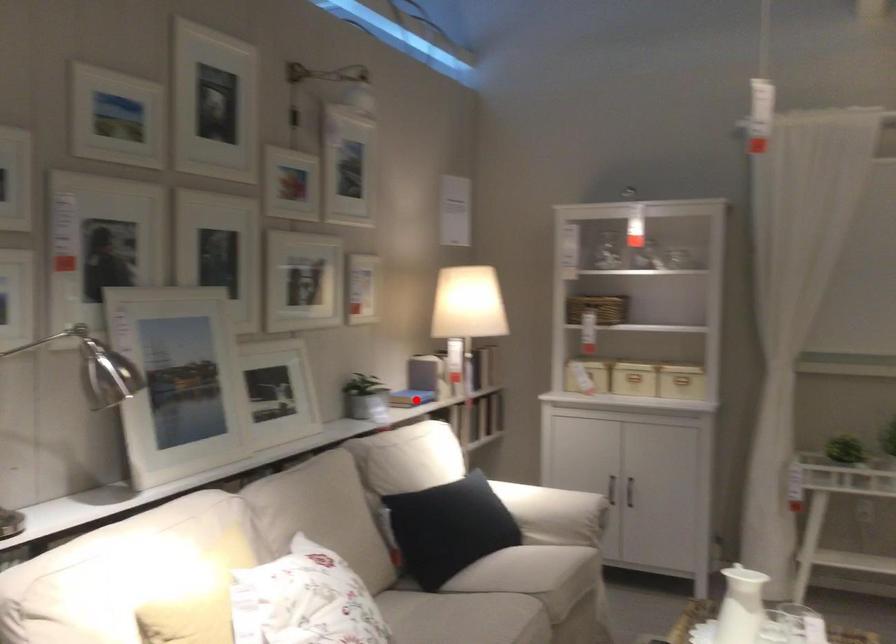
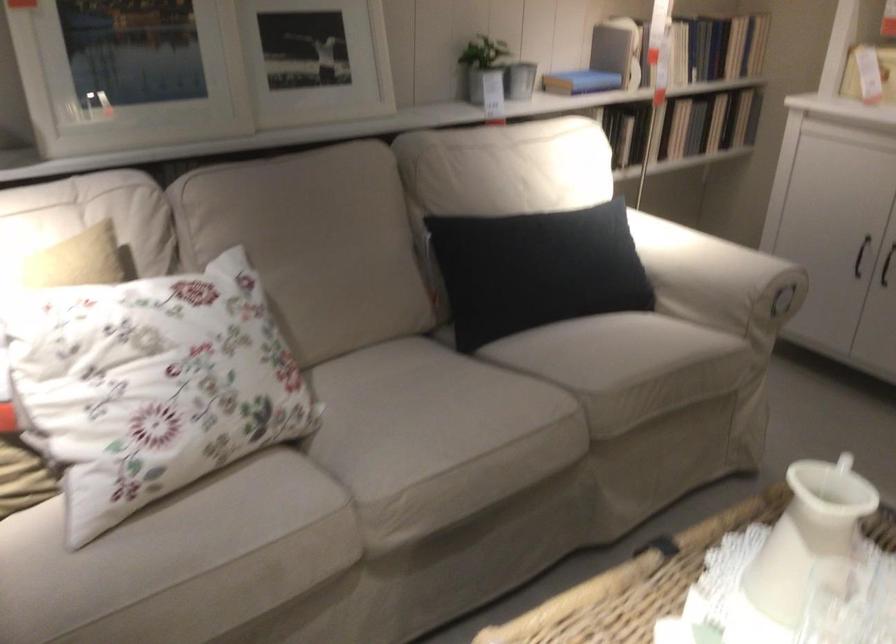
In the second image, find the point that corresponds to the highlighted location in the first image.

(580, 82)